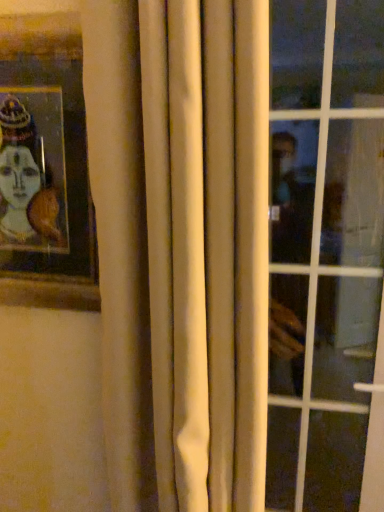
Question: Does transparent glass window at right contain wooden picture frame at upper left?

Choices:
 (A) no
 (B) yes

Answer: (A)

Question: Considering the relative positions of transparent glass window at right and wooden picture frame at upper left in the image provided, is transparent glass window at right to the left of wooden picture frame at upper left from the viewer's perspective?

Choices:
 (A) yes
 (B) no

Answer: (B)

Question: Considering the relative sizes of transparent glass window at right and wooden picture frame at upper left in the image provided, is transparent glass window at right smaller than wooden picture frame at upper left?

Choices:
 (A) yes
 (B) no

Answer: (B)

Question: Considering the relative sizes of transparent glass window at right and wooden picture frame at upper left in the image provided, is transparent glass window at right taller than wooden picture frame at upper left?

Choices:
 (A) yes
 (B) no

Answer: (A)

Question: Is wooden picture frame at upper left at the back of transparent glass window at right?

Choices:
 (A) no
 (B) yes

Answer: (A)

Question: Considering the positions of transparent glass window at right and white fabric curtain at center in the image, is transparent glass window at right wider or thinner than white fabric curtain at center?

Choices:
 (A) thin
 (B) wide

Answer: (A)

Question: Based on their sizes in the image, would you say transparent glass window at right is bigger or smaller than white fabric curtain at center?

Choices:
 (A) big
 (B) small

Answer: (B)

Question: Is transparent glass window at right in front of or behind white fabric curtain at center in the image?

Choices:
 (A) front
 (B) behind

Answer: (B)

Question: Considering the relative positions of transparent glass window at right and white fabric curtain at center in the image provided, is transparent glass window at right to the left or to the right of white fabric curtain at center?

Choices:
 (A) left
 (B) right

Answer: (B)

Question: Considering the positions of wooden picture frame at upper left and transparent glass window at right in the image, is wooden picture frame at upper left bigger or smaller than transparent glass window at right?

Choices:
 (A) small
 (B) big

Answer: (A)

Question: Looking at their shapes, would you say wooden picture frame at upper left is wider or thinner than transparent glass window at right?

Choices:
 (A) wide
 (B) thin

Answer: (B)

Question: In the image, is wooden picture frame at upper left positioned in front of or behind transparent glass window at right?

Choices:
 (A) behind
 (B) front

Answer: (B)

Question: Would you say wooden picture frame at upper left is inside or outside transparent glass window at right?

Choices:
 (A) outside
 (B) inside

Answer: (A)

Question: Is white fabric curtain at center in front of or behind wooden picture frame at upper left in the image?

Choices:
 (A) front
 (B) behind

Answer: (A)

Question: In terms of height, does white fabric curtain at center look taller or shorter compared to wooden picture frame at upper left?

Choices:
 (A) tall
 (B) short

Answer: (A)